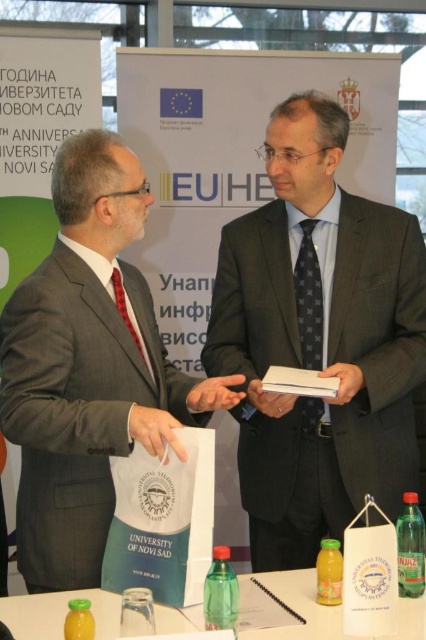
What is the object located at the coordinates point (328, 572) in the image?

The object located at point (328, 572) is a translucent plastic bottle at lower center.

You are a photographer at the event and need to adjust your equipment. You have a camera and a green plastic bottle at lower right. How far apart are these two items?

The green plastic bottle at lower right and camera are 1.39 meters apart from each other.